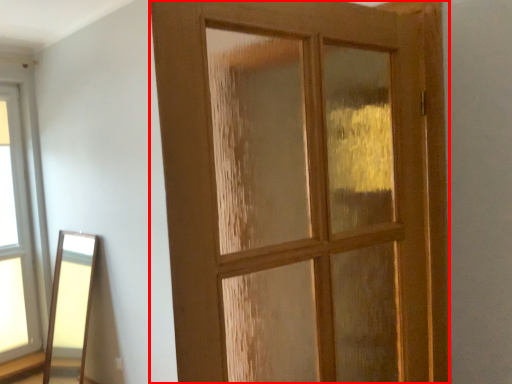
Question: From the image's perspective, what is the correct spatial relationship of door (annotated by the red box) in relation to window?

Choices:
 (A) below
 (B) above

Answer: (B)